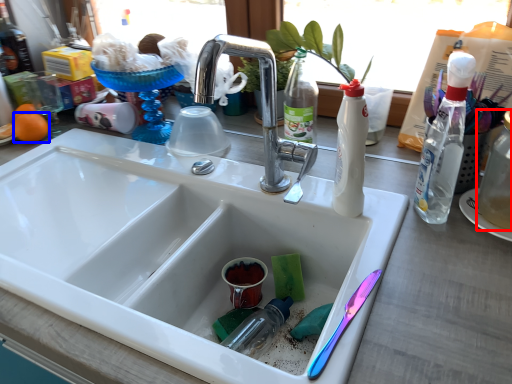
Question: Among these objects, which one is nearest to the camera, bottle (highlighted by a red box) or orange (highlighted by a blue box)?

Choices:
 (A) bottle
 (B) orange

Answer: (A)